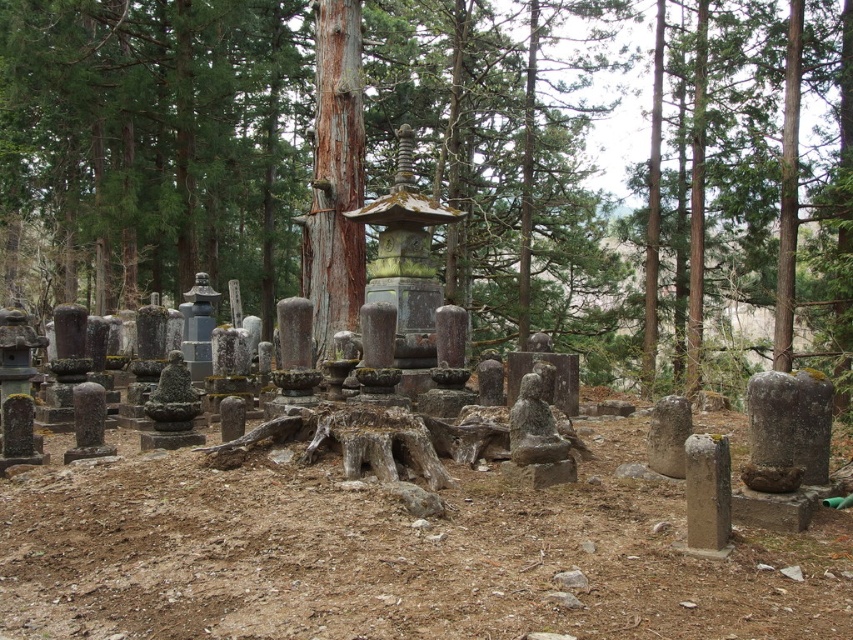
Question: Does green mossy tree trunk at center appear under smooth brown bark at center?

Choices:
 (A) yes
 (B) no

Answer: (B)

Question: Which of the following is the closest to the observer?

Choices:
 (A) (810, 266)
 (B) (335, 282)

Answer: (B)

Question: Which of the following is the farthest from the observer?

Choices:
 (A) (372, 132)
 (B) (317, 1)

Answer: (A)

Question: In this image, where is green mossy tree trunk at center located relative to smooth brown bark at center?

Choices:
 (A) above
 (B) below

Answer: (A)

Question: Does green mossy tree trunk at center have a lesser width compared to smooth brown bark at center?

Choices:
 (A) yes
 (B) no

Answer: (B)